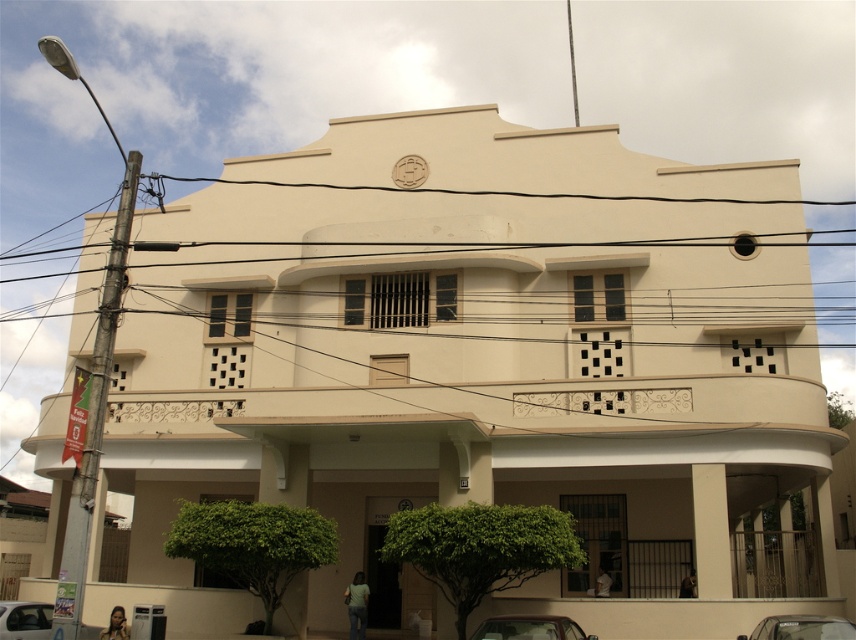
Who is positioned more to the right, black wire at upper center or metallic silver car at lower center?

metallic silver car at lower center is more to the right.

Between black wire at upper center and metallic silver car at lower center, which one is positioned higher?

Positioned higher is black wire at upper center.

Between point (265, 182) and point (581, 630), which one is positioned in front?

Positioned in front is point (581, 630).

The width and height of the screenshot is (856, 640). What are the coordinates of `black wire at upper center` in the screenshot? It's located at click(503, 192).

The width and height of the screenshot is (856, 640). What do you see at coordinates (503, 192) in the screenshot?
I see `black wire at upper center` at bounding box center [503, 192].

Measure the distance between black wire at upper center and camera.

black wire at upper center is 38.02 meters away from camera.

Does point (375, 186) come behind point (813, 616)?

Yes, point (375, 186) is farther from viewer.

Where is `black wire at upper center`? The height and width of the screenshot is (640, 856). black wire at upper center is located at coordinates (503, 192).

Can you confirm if metallic silver car at lower center is positioned to the left of metallic silver car at lower right?

Indeed, metallic silver car at lower center is positioned on the left side of metallic silver car at lower right.

Can you confirm if metallic silver car at lower center is taller than metallic silver car at lower right?

Yes.

What do you see at coordinates (528, 628) in the screenshot?
I see `metallic silver car at lower center` at bounding box center [528, 628].

At what (x,y) coordinates should I click in order to perform the action: click on metallic silver car at lower center. Please return your answer as a coordinate pair (x, y). Looking at the image, I should click on pyautogui.click(x=528, y=628).